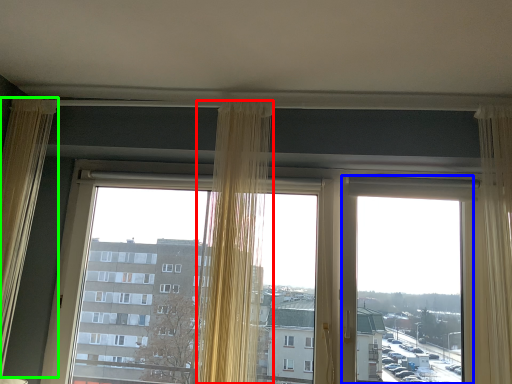
Question: Which object is the farthest from curtain (highlighted by a red box)? Choose among these: window screen (highlighted by a blue box) or curtain (highlighted by a green box).

Choices:
 (A) window screen
 (B) curtain

Answer: (B)